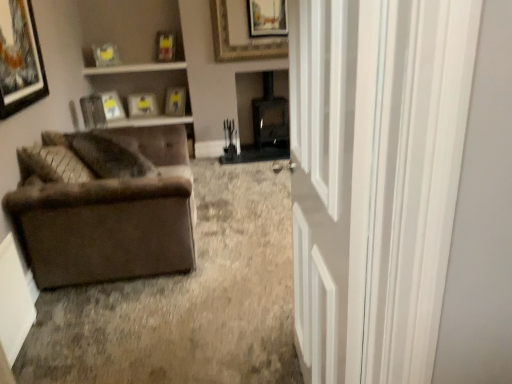
Question: Can you confirm if matte yellow picture frame at upper center, the 2th picture frame positioned from the back, is bigger than white glossy door at right?

Choices:
 (A) yes
 (B) no

Answer: (B)

Question: Are matte yellow picture frame at upper center, the 2th picture frame positioned from the back, and white glossy door at right located far from each other?

Choices:
 (A) no
 (B) yes

Answer: (B)

Question: Is matte yellow picture frame at upper center, the 2th picture frame positioned from the back, further to the viewer compared to white glossy door at right?

Choices:
 (A) yes
 (B) no

Answer: (A)

Question: From the image's perspective, does matte yellow picture frame at upper center, the 2th picture frame positioned from the back, appear lower than white glossy door at right?

Choices:
 (A) no
 (B) yes

Answer: (A)

Question: From a real-world perspective, is matte yellow picture frame at upper center, acting as the 7th picture frame starting from the front, located beneath white glossy door at right?

Choices:
 (A) no
 (B) yes

Answer: (B)

Question: Is point (39, 56) positioned closer to the camera than point (170, 49)?

Choices:
 (A) closer
 (B) farther

Answer: (A)

Question: Would you say matte black picture frame at upper left, marked as the 1th picture frame in a front-to-back arrangement, is inside or outside matte plastic picture frame at upper center, arranged as the fourth picture frame when viewed from the back?

Choices:
 (A) outside
 (B) inside

Answer: (A)

Question: In terms of size, does matte black picture frame at upper left, marked as the 1th picture frame in a front-to-back arrangement, appear bigger or smaller than matte plastic picture frame at upper center, arranged as the fourth picture frame when viewed from the back?

Choices:
 (A) small
 (B) big

Answer: (B)

Question: From the image's perspective, is matte black picture frame at upper left, marked as the 1th picture frame in a front-to-back arrangement, positioned above or below matte plastic picture frame at upper center, arranged as the fourth picture frame when viewed from the back?

Choices:
 (A) above
 (B) below

Answer: (B)

Question: Considering the relative positions of matte plastic picture frame at upper center, the 5th picture frame in the front-to-back sequence, and matte wooden picture frame at upper center, placed as the 8th picture frame when sorted from front to back, in the image provided, is matte plastic picture frame at upper center, the 5th picture frame in the front-to-back sequence, to the left or to the right of matte wooden picture frame at upper center, placed as the 8th picture frame when sorted from front to back,?

Choices:
 (A) left
 (B) right

Answer: (B)

Question: Is point (159, 34) closer or farther from the camera than point (138, 104)?

Choices:
 (A) closer
 (B) farther

Answer: (A)

Question: Is matte plastic picture frame at upper center, arranged as the fourth picture frame when viewed from the back, situated inside matte wooden picture frame at upper center, the first picture frame from the back, or outside?

Choices:
 (A) inside
 (B) outside

Answer: (B)

Question: From a real-world perspective, is matte plastic picture frame at upper center, the 5th picture frame in the front-to-back sequence, above or below matte wooden picture frame at upper center, the first picture frame from the back?

Choices:
 (A) below
 (B) above

Answer: (B)

Question: Considering the positions of matte wooden picture frame at upper left, which is the third picture frame from back to front, and matte yellow picture frame at upper left, the fourth picture frame from the front, in the image, is matte wooden picture frame at upper left, which is the third picture frame from back to front, wider or thinner than matte yellow picture frame at upper left, the fourth picture frame from the front,?

Choices:
 (A) wide
 (B) thin

Answer: (A)

Question: Choose the correct answer: Is matte wooden picture frame at upper left, which is the third picture frame from back to front, inside matte yellow picture frame at upper left, the 5th picture frame from the back, or outside it?

Choices:
 (A) outside
 (B) inside

Answer: (A)